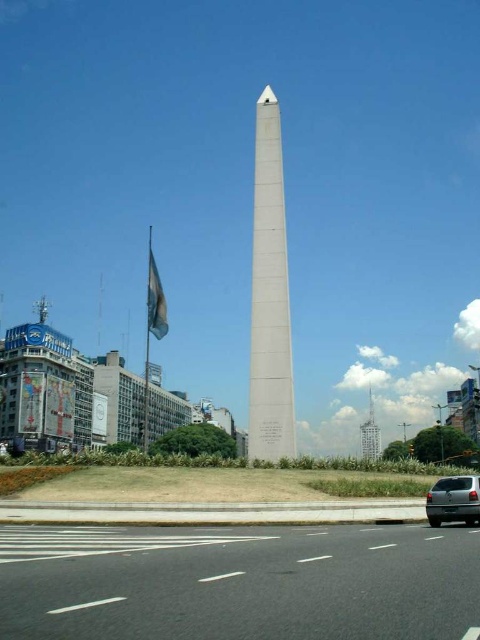
Question: Which of these objects is positioned closest to the white fabric flag at left?

Choices:
 (A) white polished stone obelisk at center
 (B) silver metallic van at lower right
 (C) smooth glass tower at right
 (D) black asphalt road at lower center

Answer: (D)

Question: Which point is closer to the camera?

Choices:
 (A) smooth glass tower at right
 (B) white fabric flag at left
 (C) black asphalt road at lower center

Answer: (C)

Question: Can you confirm if silver metallic van at lower right is smaller than white fabric flag at left?

Choices:
 (A) yes
 (B) no

Answer: (A)

Question: Can you confirm if white polished stone obelisk at center is positioned below white fabric flag at left?

Choices:
 (A) no
 (B) yes

Answer: (B)

Question: Is white fabric flag at left bigger than smooth glass tower at right?

Choices:
 (A) yes
 (B) no

Answer: (A)

Question: Which point is farther to the camera?

Choices:
 (A) (374, 435)
 (B) (371, 538)
 (C) (168, 326)

Answer: (A)